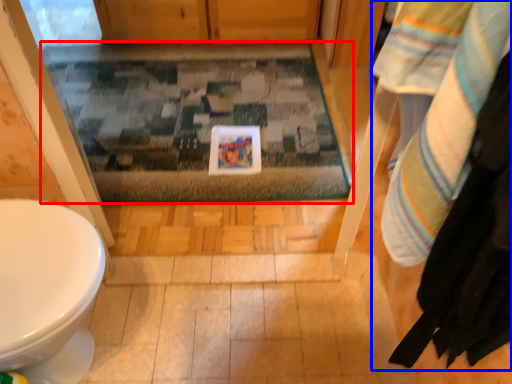
Question: Which object is further to the camera taking this photo, bath mat (highlighted by a red box) or laundry (highlighted by a blue box)?

Choices:
 (A) bath mat
 (B) laundry

Answer: (A)